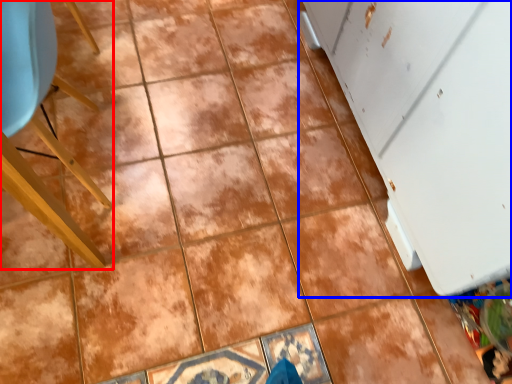
Question: Which object appears farthest to the camera in this image, furniture (highlighted by a red box) or screen door (highlighted by a blue box)?

Choices:
 (A) furniture
 (B) screen door

Answer: (A)